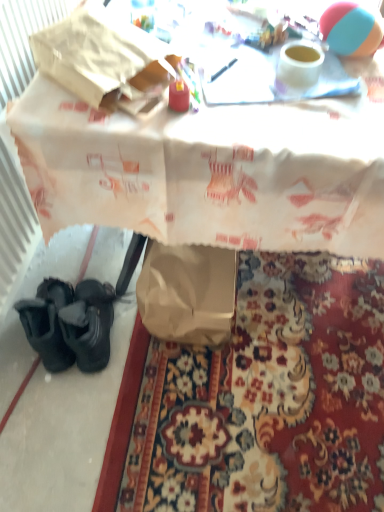
Question: Is white paper bag at lower left to the left or to the right of rubber beach ball at upper right in the image?

Choices:
 (A) left
 (B) right

Answer: (A)

Question: Considering the positions of white paper bag at lower left and rubber beach ball at upper right in the image, is white paper bag at lower left bigger or smaller than rubber beach ball at upper right?

Choices:
 (A) small
 (B) big

Answer: (B)

Question: Which object is positioned closest to the rubber beach ball at upper right?

Choices:
 (A) brown paper bag at lower left
 (B) white paper bag at lower left

Answer: (B)

Question: Which is nearer to the rubber beach ball at upper right?

Choices:
 (A) white paper bag at lower left
 (B) brown paper bag at lower left

Answer: (A)